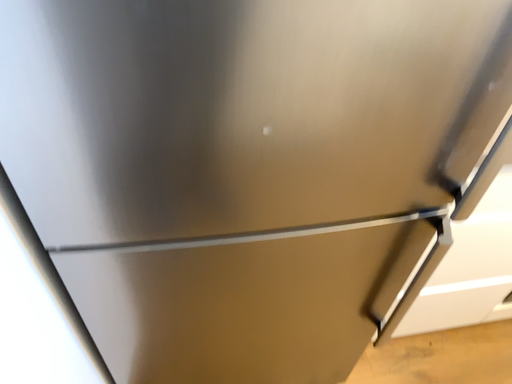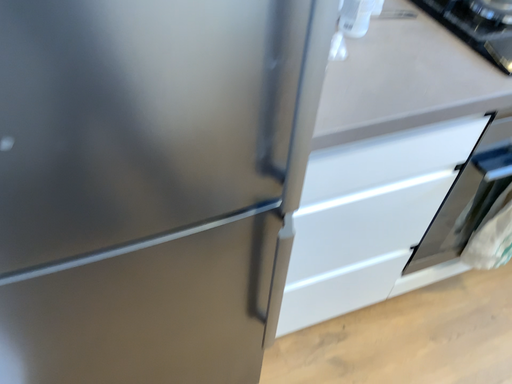
Question: Which way did the camera rotate in the video?

Choices:
 (A) rotated left
 (B) rotated right

Answer: (B)